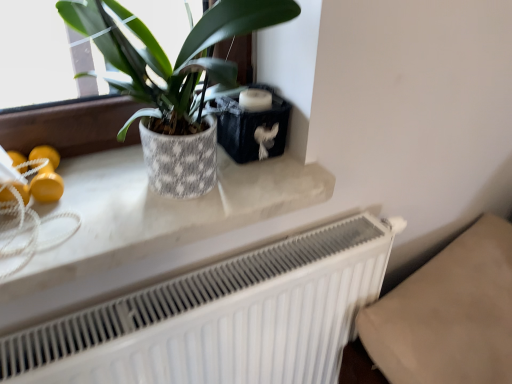
Measure the distance between textured ceramic pot at upper left and camera.

24.42 inches.

Locate an element on the screen. Image resolution: width=512 pixels, height=384 pixels. white marble counter top at upper center is located at coordinates (147, 227).

Is white matte radiator at lower center not near textured ceramic pot at upper left?

white matte radiator at lower center is actually quite close to textured ceramic pot at upper left.

Which of these two, white matte radiator at lower center or textured ceramic pot at upper left, is thinner?

white matte radiator at lower center.

From the image's perspective, between white matte radiator at lower center and textured ceramic pot at upper left, which one is located above?

textured ceramic pot at upper left appears higher in the image.

Would you consider white marble counter top at upper center to be distant from white matte radiator at lower center?

No, white marble counter top at upper center is not far from white matte radiator at lower center.

Would you say white marble counter top at upper center is inside or outside white matte radiator at lower center?

white marble counter top at upper center is located beyond the bounds of white matte radiator at lower center.

From a real-world perspective, is white marble counter top at upper center above or below white matte radiator at lower center?

Clearly, from a real-world perspective, white marble counter top at upper center is above white matte radiator at lower center.

Image resolution: width=512 pixels, height=384 pixels. In order to click on counter top lying above the white matte radiator at lower center (from the image's perspective) in this screenshot , I will do `click(147, 227)`.

Is point (38, 257) more distant than point (226, 80)?

That is False.

Would you say white marble counter top at upper center contains textured ceramic pot at upper left?

Definitely not — textured ceramic pot at upper left is not inside white marble counter top at upper center.

In terms of height, does white marble counter top at upper center look taller or shorter compared to textured ceramic pot at upper left?

In the image, white marble counter top at upper center appears to be shorter than textured ceramic pot at upper left.

Which of these two, textured ceramic pot at upper left or white marble counter top at upper center, is thinner?

white marble counter top at upper center is thinner.

Considering the relative sizes of textured ceramic pot at upper left and white marble counter top at upper center in the image provided, is textured ceramic pot at upper left bigger than white marble counter top at upper center?

Indeed, textured ceramic pot at upper left has a larger size compared to white marble counter top at upper center.

From a real-world perspective, relative to white marble counter top at upper center, is textured ceramic pot at upper left vertically above or below?

textured ceramic pot at upper left is situated higher than white marble counter top at upper center in the real world.

Considering the positions of objects textured ceramic pot at upper left and white marble counter top at upper center in the image provided, who is more to the left, textured ceramic pot at upper left or white marble counter top at upper center?

From the viewer's perspective, white marble counter top at upper center appears more on the left side.

Does textured ceramic pot at upper left lie behind white matte radiator at lower center?

No, textured ceramic pot at upper left is closer to the camera.

Where is `houseplant that appears in front of the white matte radiator at lower center`? houseplant that appears in front of the white matte radiator at lower center is located at coordinates (175, 78).

From a real-world perspective, which is physically above, textured ceramic pot at upper left or white matte radiator at lower center?

textured ceramic pot at upper left, from a real-world perspective.

Is textured ceramic pot at upper left facing towards white matte radiator at lower center?

No, textured ceramic pot at upper left is not aimed at white matte radiator at lower center.

Is white marble counter top at upper center a part of white matte radiator at lower center?

No, white marble counter top at upper center is not inside white matte radiator at lower center.

Which is farther, (268, 369) or (127, 217)?

Positioned behind is point (268, 369).

How far apart are white matte radiator at lower center and white marble counter top at upper center?

A distance of 6.23 inches exists between white matte radiator at lower center and white marble counter top at upper center.

Where is `radiator that appears below the white marble counter top at upper center (from a real-world perspective)`? The image size is (512, 384). radiator that appears below the white marble counter top at upper center (from a real-world perspective) is located at coordinates (221, 318).

The image size is (512, 384). In the image, there is a textured ceramic pot at upper left. What are the coordinates of `radiator below it (from the image's perspective)` in the screenshot? It's located at (221, 318).

What are the coordinates of `counter top that appears on the left of white matte radiator at lower center` in the screenshot? It's located at (147, 227).

From the image, which object appears to be nearer to white matte radiator at lower center, textured ceramic pot at upper left or white marble counter top at upper center?

Based on the image, white marble counter top at upper center appears to be nearer to white matte radiator at lower center.

When comparing their distances from white marble counter top at upper center, does white matte radiator at lower center or textured ceramic pot at upper left seem further?

Among the two, textured ceramic pot at upper left is located further to white marble counter top at upper center.

From the image, which object appears to be nearer to white marble counter top at upper center, textured ceramic pot at upper left or white matte radiator at lower center?

white matte radiator at lower center is positioned closer to the anchor white marble counter top at upper center.

Looking at the image, which one is located further to white matte radiator at lower center, white marble counter top at upper center or textured ceramic pot at upper left?

The object further to white matte radiator at lower center is textured ceramic pot at upper left.

Considering their positions, is white matte radiator at lower center positioned further to textured ceramic pot at upper left than white marble counter top at upper center?

The object further to textured ceramic pot at upper left is white matte radiator at lower center.

When comparing their distances from textured ceramic pot at upper left, does white marble counter top at upper center or white matte radiator at lower center seem closer?

white marble counter top at upper center lies closer to textured ceramic pot at upper left than the other object.

In order to click on counter top between textured ceramic pot at upper left and white matte radiator at lower center in the up-down direction in this screenshot , I will do `click(147, 227)`.